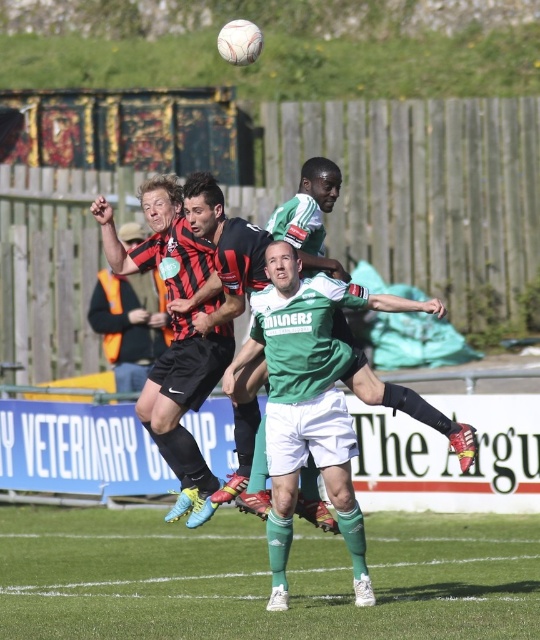
Question: Is black matte shorts at center above matte black shorts at center?

Choices:
 (A) yes
 (B) no

Answer: (B)

Question: Which object appears farthest from the camera in this image?

Choices:
 (A) green grass at center
 (B) white matte soccer player at center
 (C) black matte shorts at center

Answer: (C)

Question: Is green grass at center above white matte soccer player at center?

Choices:
 (A) no
 (B) yes

Answer: (A)

Question: Among these objects, which one is farthest from the camera?

Choices:
 (A) black matte shorts at center
 (B) green grass at center
 (C) white matte soccer player at center
 (D) matte black shorts at center

Answer: (D)

Question: Which point appears farthest from the camera in this image?

Choices:
 (A) (237, 420)
 (B) (19, 566)
 (C) (179, 296)

Answer: (B)

Question: Does black matte shorts at center appear on the left side of white matte soccer player at center?

Choices:
 (A) yes
 (B) no

Answer: (A)